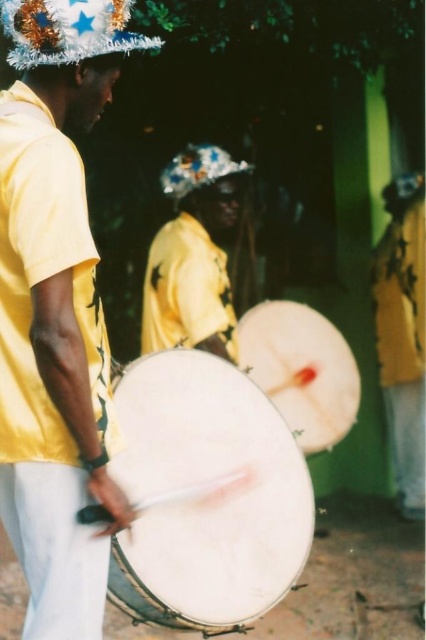
Who is taller, white drum at center or shiny metallic hat at upper left?

white drum at center is taller.

Who is shorter, white drum at center or shiny metallic hat at upper left?

shiny metallic hat at upper left is shorter.

Is point (146, 376) farther from viewer compared to point (118, 35)?

Yes, point (146, 376) is behind point (118, 35).

This screenshot has height=640, width=426. In order to click on white drum at center in this screenshot , I will do `click(207, 506)`.

Can you confirm if yellow matte shirt at center is thinner than yellow matte shirt at right?

In fact, yellow matte shirt at center might be wider than yellow matte shirt at right.

Does yellow matte shirt at center appear on the left side of yellow matte shirt at right?

Indeed, yellow matte shirt at center is positioned on the left side of yellow matte shirt at right.

What do you see at coordinates (193, 256) in the screenshot? The height and width of the screenshot is (640, 426). I see `yellow matte shirt at center` at bounding box center [193, 256].

This screenshot has width=426, height=640. In order to click on yellow matte shirt at center in this screenshot , I will do `click(193, 256)`.

Which is more to the left, white drum at center or yellow matte shirt at right?

white drum at center

Between white drum at center and yellow matte shirt at right, which one appears on the right side from the viewer's perspective?

Positioned to the right is yellow matte shirt at right.

The image size is (426, 640). I want to click on white drum at center, so click(x=207, y=506).